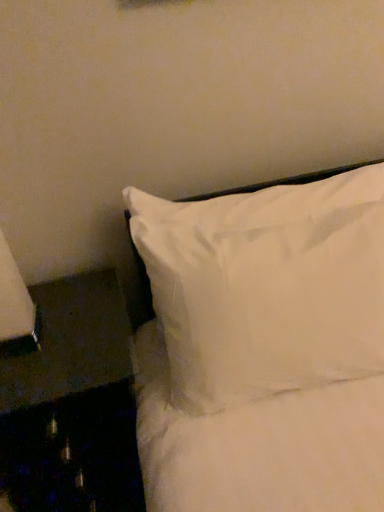
Question: Would you say white soft pillow at upper right is outside black fabric side table at lower left?

Choices:
 (A) no
 (B) yes

Answer: (B)

Question: Is white soft pillow at upper right shorter than black fabric side table at lower left?

Choices:
 (A) yes
 (B) no

Answer: (A)

Question: From the image's perspective, does white soft pillow at upper right appear lower than black fabric side table at lower left?

Choices:
 (A) no
 (B) yes

Answer: (A)

Question: Could you tell me if white soft pillow at upper right is facing black fabric side table at lower left?

Choices:
 (A) yes
 (B) no

Answer: (B)

Question: Does white soft pillow at upper right have a smaller size compared to black fabric side table at lower left?

Choices:
 (A) no
 (B) yes

Answer: (A)

Question: From a real-world perspective, does white soft pillow at upper right stand above black fabric side table at lower left?

Choices:
 (A) no
 (B) yes

Answer: (B)

Question: Is the depth of black fabric side table at lower left greater than that of white soft pillow at upper right?

Choices:
 (A) yes
 (B) no

Answer: (A)

Question: From a real-world perspective, does black fabric side table at lower left sit lower than white soft pillow at upper right?

Choices:
 (A) yes
 (B) no

Answer: (A)

Question: Can you confirm if black fabric side table at lower left is thinner than white soft pillow at upper right?

Choices:
 (A) yes
 (B) no

Answer: (B)

Question: Could you tell me if black fabric side table at lower left is turned towards white soft pillow at upper right?

Choices:
 (A) yes
 (B) no

Answer: (B)

Question: From the image's perspective, is black fabric side table at lower left beneath white soft pillow at upper right?

Choices:
 (A) yes
 (B) no

Answer: (A)

Question: Is black fabric side table at lower left touching white soft pillow at upper right?

Choices:
 (A) no
 (B) yes

Answer: (A)

Question: In terms of height, does white soft pillow at upper right look taller or shorter compared to black fabric side table at lower left?

Choices:
 (A) tall
 (B) short

Answer: (B)